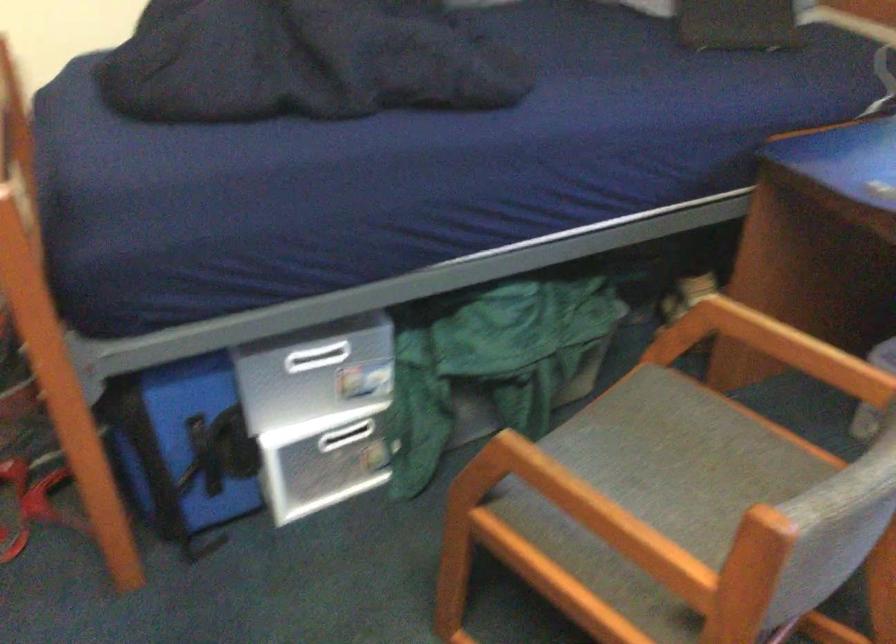
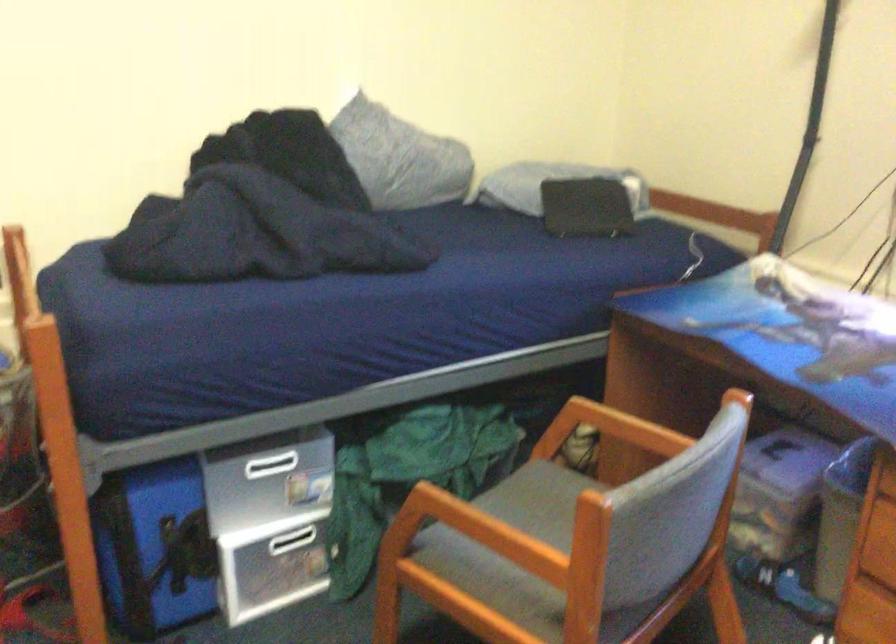
Find the pixel in the second image that matches point (655, 424) in the first image.

(540, 500)